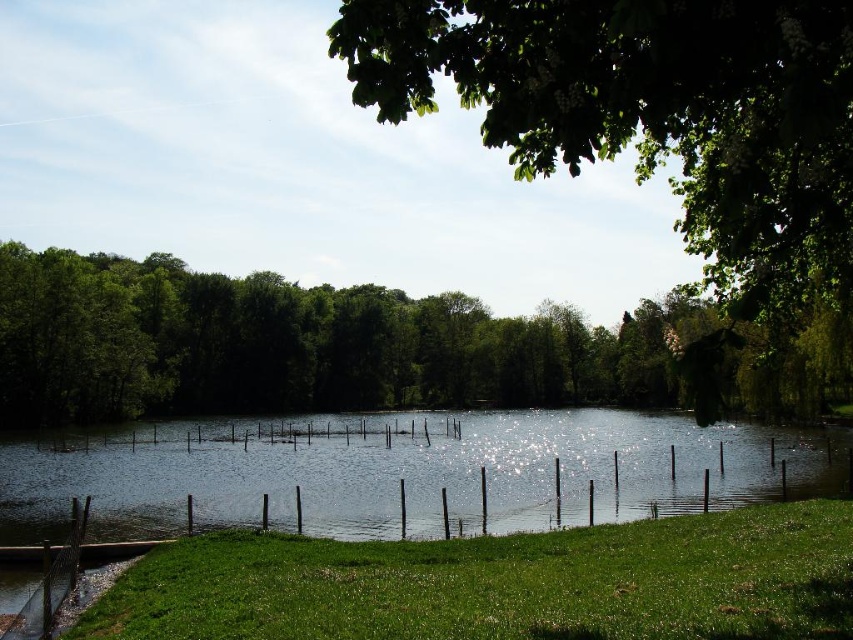
You are standing at the lakeside and want to place two markers at the points labeled point [613,131] and point [183,493]. Based on the scene, which marker will be closer to your current position?

Point [613,131] is closer to the camera than point [183,493], so the marker at point [613,131] will be closer to your current position.